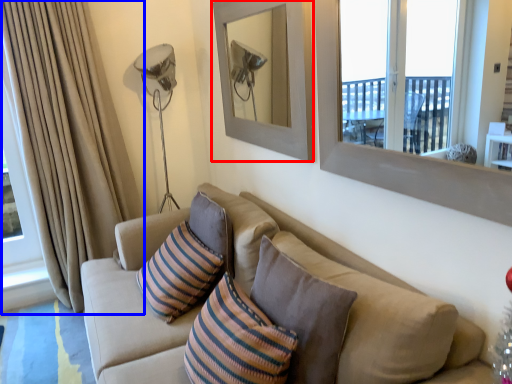
Question: Which object is closer to the camera taking this photo, picture frame (highlighted by a red box) or curtain (highlighted by a blue box)?

Choices:
 (A) picture frame
 (B) curtain

Answer: (A)